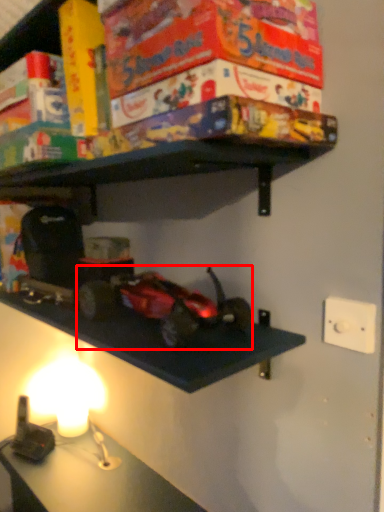
Question: From the image's perspective, what is the correct spatial positioning of toy (annotated by the red box) in reference to light switch?

Choices:
 (A) below
 (B) above

Answer: (B)